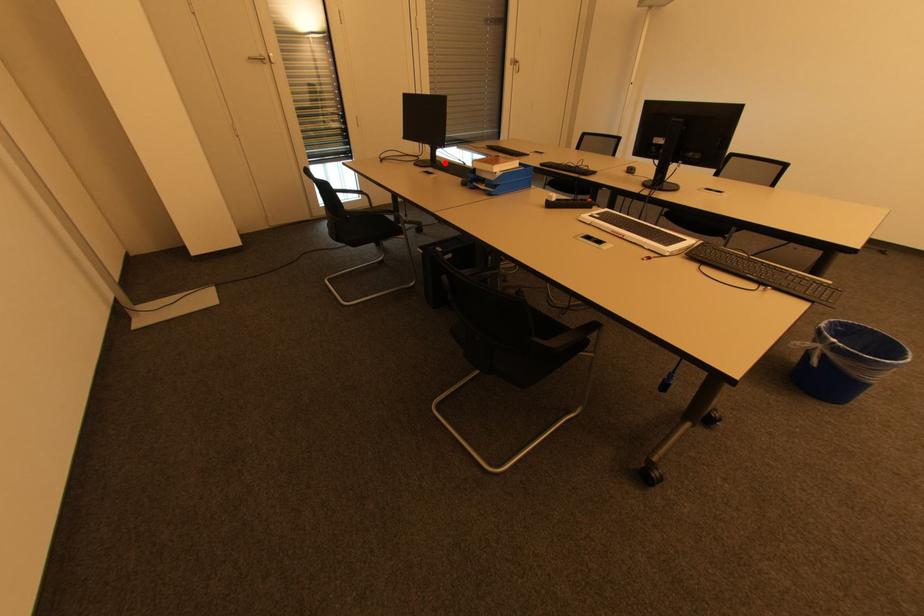
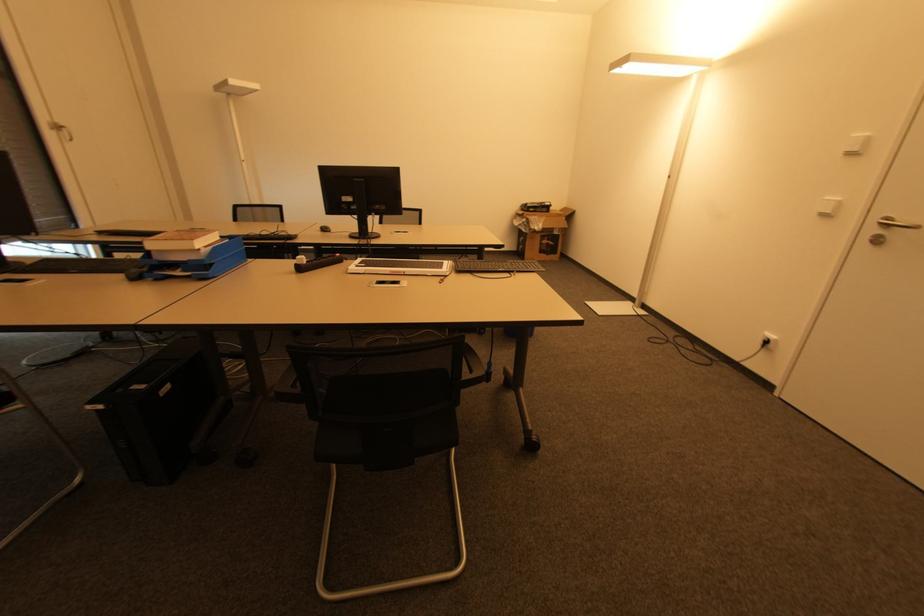
Question: I am providing you with two images of the same scene from different viewpoints. Given a red point in image1, look at the same physical point in image2. Is it:

Choices:
 (A) Closer to the viewpoint
 (B) Farther from the viewpoint

Answer: (B)